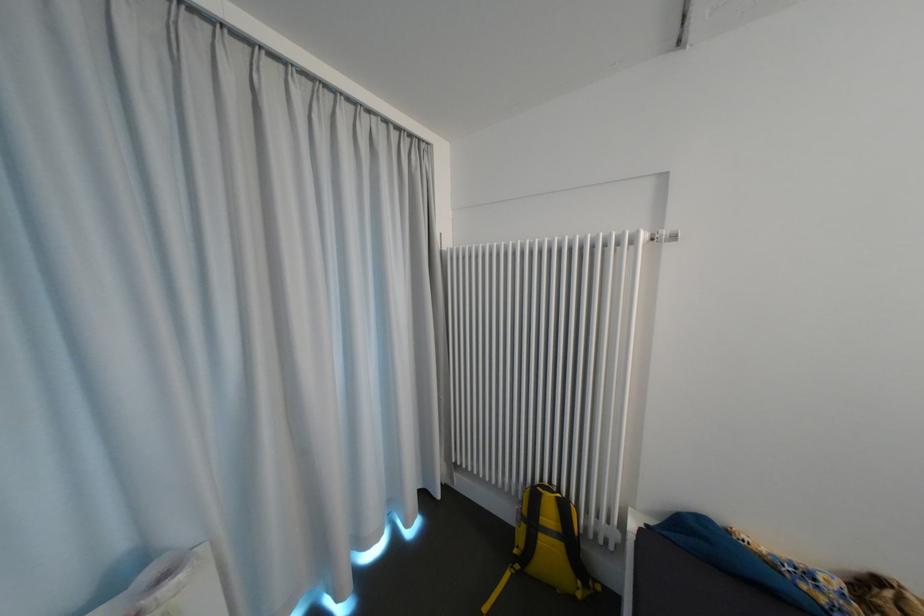
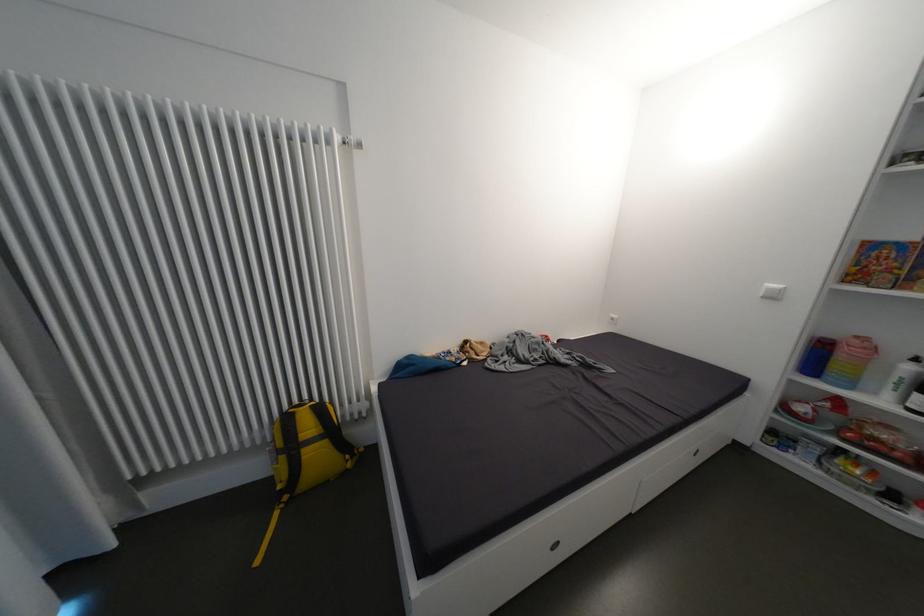
Question: The camera is either moving clockwise (left) or counter-clockwise (right) around the object. The first image is from the beginning of the video and the second image is from the end. Is the camera moving left or right when shooting the video?

Choices:
 (A) Left
 (B) Right

Answer: (A)